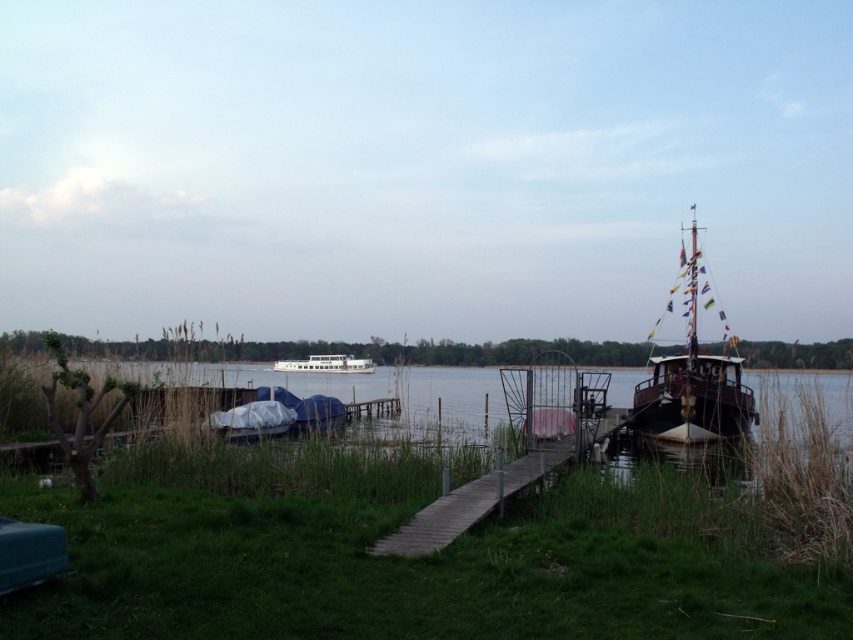
Question: Which object is farther from the camera taking this photo?

Choices:
 (A) wooden at center
 (B) clear water at center
 (C) green grass at lower left

Answer: (B)

Question: Which of the following is the farthest from the observer?

Choices:
 (A) (677, 378)
 (B) (253, 614)

Answer: (A)

Question: Is green grass at lower left to the left of wooden sailboat at right from the viewer's perspective?

Choices:
 (A) yes
 (B) no

Answer: (A)

Question: Considering the real-world distances, which object is closest to the wooden at center?

Choices:
 (A) wooden sailboat at right
 (B) clear water at center

Answer: (A)

Question: Is clear water at center to the left of white glossy ferry at center from the viewer's perspective?

Choices:
 (A) no
 (B) yes

Answer: (A)

Question: Does wooden sailboat at right appear under wooden at center?

Choices:
 (A) yes
 (B) no

Answer: (B)